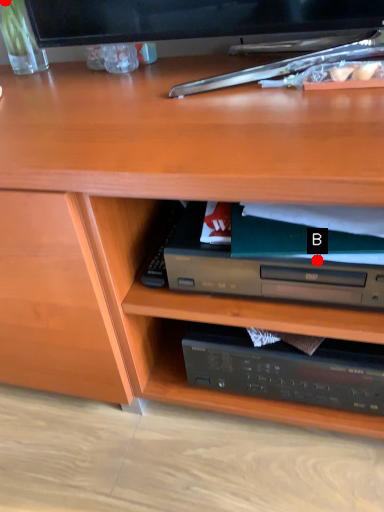
Question: Two points are circled on the image, labeled by A and B beside each circle. Which point appears farthest from the camera in this image?

Choices:
 (A) A is further
 (B) B is further

Answer: (A)